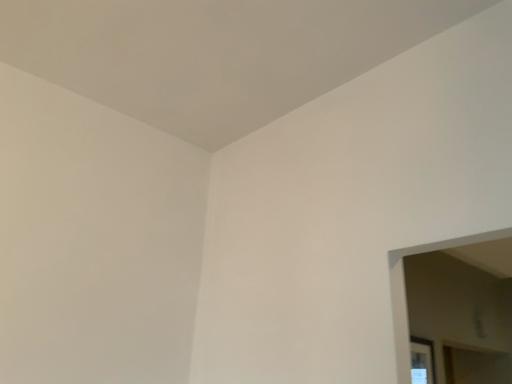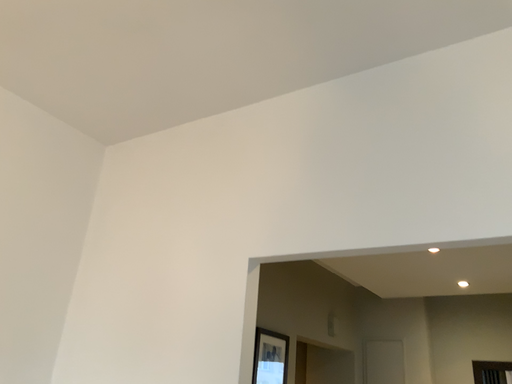
Question: Which way did the camera rotate in the video?

Choices:
 (A) rotated left
 (B) rotated right

Answer: (B)